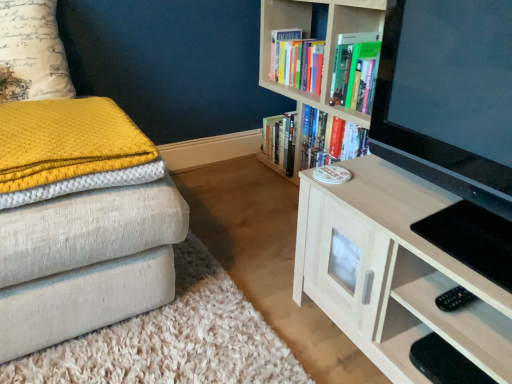
Question: Is yellow textured pillow at upper left thinner than hardcover books at upper center, the 1th book positioned from the top?

Choices:
 (A) no
 (B) yes

Answer: (A)

Question: Does yellow textured pillow at upper left have a larger size compared to hardcover books at upper center, the 1th book positioned from the top?

Choices:
 (A) yes
 (B) no

Answer: (A)

Question: Are yellow textured pillow at upper left and hardcover books at upper center, acting as the 2th book starting from the bottom, far apart?

Choices:
 (A) no
 (B) yes

Answer: (B)

Question: Can you confirm if yellow textured pillow at upper left is wider than hardcover books at upper center, the 1th book positioned from the top?

Choices:
 (A) no
 (B) yes

Answer: (B)

Question: Does yellow textured pillow at upper left have a greater height compared to hardcover books at upper center, the 1th book positioned from the top?

Choices:
 (A) no
 (B) yes

Answer: (B)

Question: Does point pos(281,59) appear closer or farther from the camera than point pos(502,36)?

Choices:
 (A) closer
 (B) farther

Answer: (B)

Question: In terms of size, does hardcover books at upper center, acting as the 2th book starting from the bottom, appear bigger or smaller than light wood cabinet at center, which appears as the second bookcase when viewed from the back?

Choices:
 (A) small
 (B) big

Answer: (A)

Question: In the image, is hardcover books at upper center, acting as the 2th book starting from the bottom, positioned in front of or behind light wood cabinet at center, which appears as the second bookcase when viewed from the back?

Choices:
 (A) behind
 (B) front

Answer: (A)

Question: Looking at their shapes, would you say hardcover books at upper center, acting as the 2th book starting from the bottom, is wider or thinner than light wood cabinet at center, marked as the 1th bookcase in a front-to-back arrangement?

Choices:
 (A) thin
 (B) wide

Answer: (A)

Question: Considering the relative positions of light wood cabinet at center, marked as the 1th bookcase in a front-to-back arrangement, and black plastic remote control at lower right in the image provided, is light wood cabinet at center, marked as the 1th bookcase in a front-to-back arrangement, to the left or to the right of black plastic remote control at lower right?

Choices:
 (A) right
 (B) left

Answer: (B)

Question: In terms of width, does light wood cabinet at center, which appears as the second bookcase when viewed from the back, look wider or thinner when compared to black plastic remote control at lower right?

Choices:
 (A) wide
 (B) thin

Answer: (A)

Question: Which is correct: light wood cabinet at center, which appears as the second bookcase when viewed from the back, is inside black plastic remote control at lower right, or outside of it?

Choices:
 (A) outside
 (B) inside

Answer: (A)

Question: From the image's perspective, is light wood cabinet at center, marked as the 1th bookcase in a front-to-back arrangement, above or below black plastic remote control at lower right?

Choices:
 (A) below
 (B) above

Answer: (B)

Question: From the image's perspective, relative to hardcover books at upper center, the 1th book positioned from the top, is black plastic remote control at lower right above or below?

Choices:
 (A) below
 (B) above

Answer: (A)

Question: From a real-world perspective, is black plastic remote control at lower right physically located above or below hardcover books at upper center, the 1th book positioned from the top?

Choices:
 (A) below
 (B) above

Answer: (A)